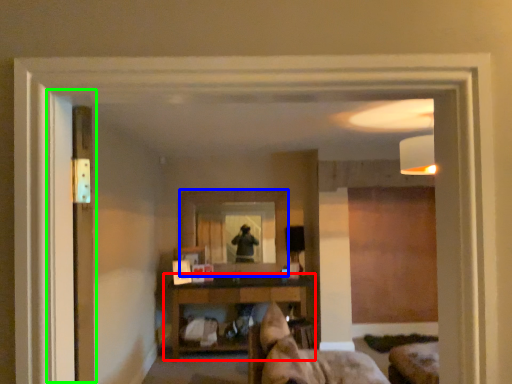
Question: Which object is the closest to the shelf (highlighted by a red box)? Choose among these: mirror (highlighted by a blue box) or screen door (highlighted by a green box).

Choices:
 (A) mirror
 (B) screen door

Answer: (A)